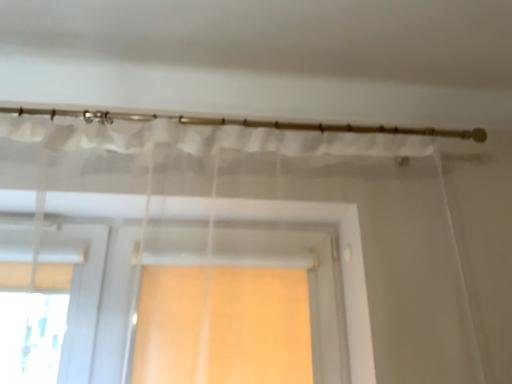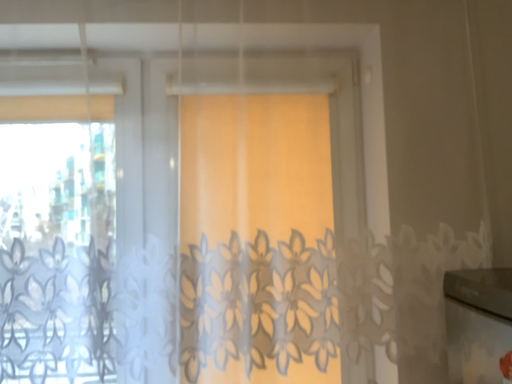
Question: How did the camera likely rotate when shooting the video?

Choices:
 (A) rotated downward
 (B) rotated upward

Answer: (A)